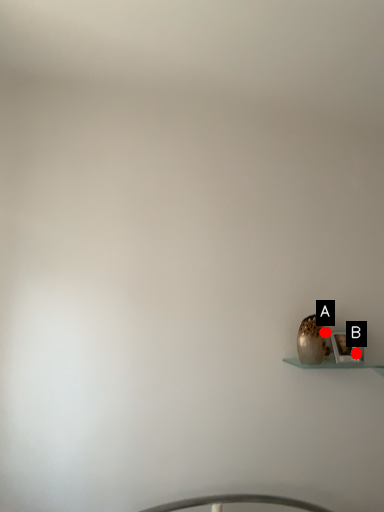
Question: Two points are circled on the image, labeled by A and B beside each circle. Which point is farther to the camera?

Choices:
 (A) A is further
 (B) B is further

Answer: (A)